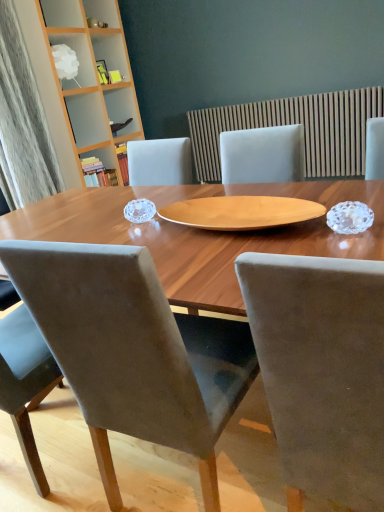
Question: Visually, is wooden bookshelf at upper left, which is the second shelf from top to bottom, positioned to the left or to the right of white frosted glass lampshade at upper left, the 1th shelf positioned from the top?

Choices:
 (A) left
 (B) right

Answer: (B)

Question: From a real-world perspective, is wooden bookshelf at upper left, which is the second shelf from top to bottom, physically located above or below white frosted glass lampshade at upper left, the 2th shelf in the bottom-to-top sequence?

Choices:
 (A) above
 (B) below

Answer: (B)

Question: Which object is the closest to the wooden bookshelf at upper left, the 1th shelf from the bottom?

Choices:
 (A) velvet grey chair at center, positioned as the second chair in right-to-left order
 (B) white frosted glass lampshade at upper left, the 2th shelf in the bottom-to-top sequence
 (C) suede chair at center, the 1th chair when ordered from right to left
 (D) wooden slats at upper center

Answer: (B)

Question: Estimate the real-world distances between objects in this image. Which object is farther from the suede chair at center, the 1th chair when ordered from right to left?

Choices:
 (A) wooden slats at upper center
 (B) velvet grey chair at center, the 1th chair viewed from the left
 (C) white frosted glass lampshade at upper left, the 1th shelf positioned from the top
 (D) wooden bookshelf at upper left, the 1th shelf from the bottom

Answer: (C)